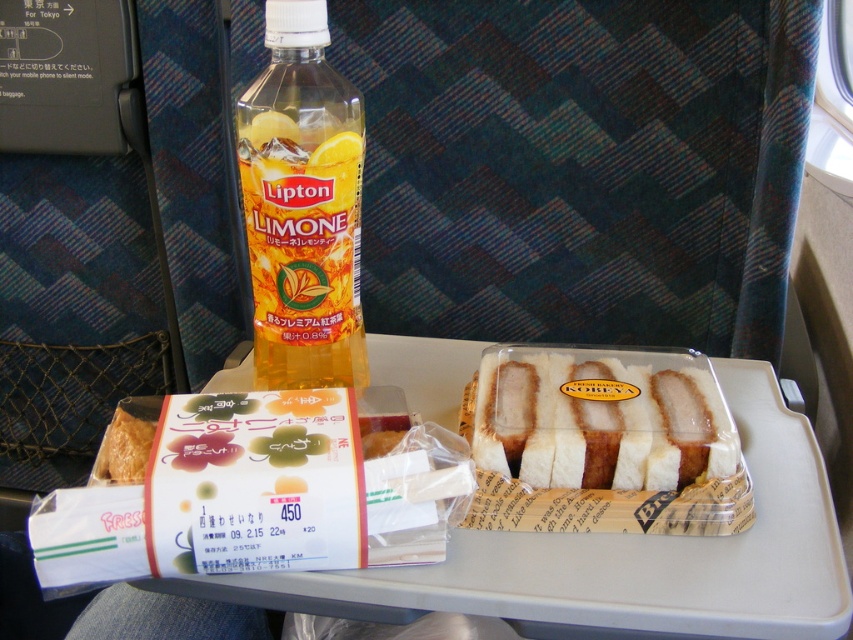
Question: Is yellow translucent plastic bottle at center further to the viewer compared to white bread sandwich at center?

Choices:
 (A) no
 (B) yes

Answer: (A)

Question: Among these points, which one is farthest from the camera?

Choices:
 (A) (639, 404)
 (B) (331, 348)

Answer: (B)

Question: Does yellow translucent plastic bottle at center have a larger size compared to white bread sandwich at center?

Choices:
 (A) yes
 (B) no

Answer: (A)

Question: Is yellow translucent plastic bottle at center above white bread sandwich at center?

Choices:
 (A) no
 (B) yes

Answer: (B)

Question: Which of the following is the farthest from the observer?

Choices:
 (A) (350, 141)
 (B) (706, 432)

Answer: (B)